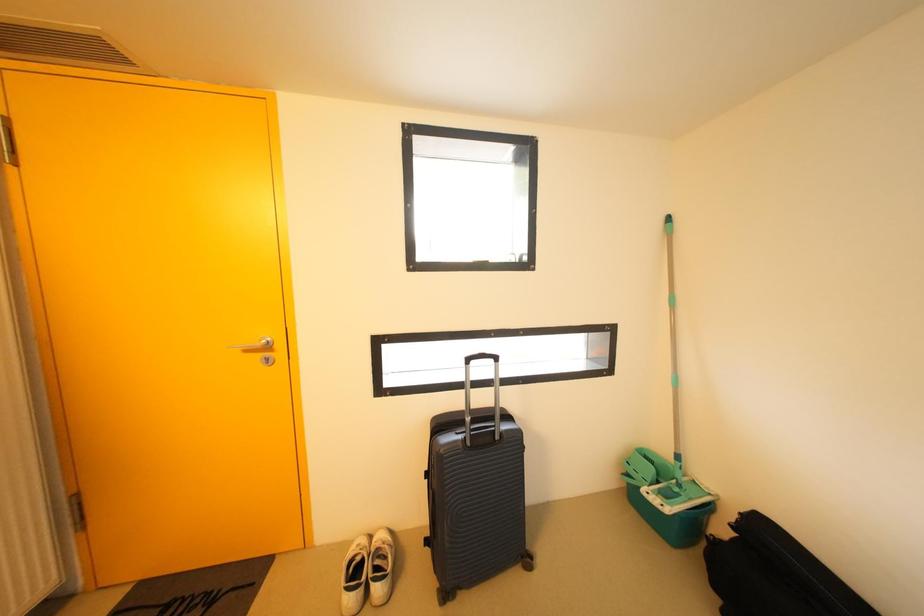
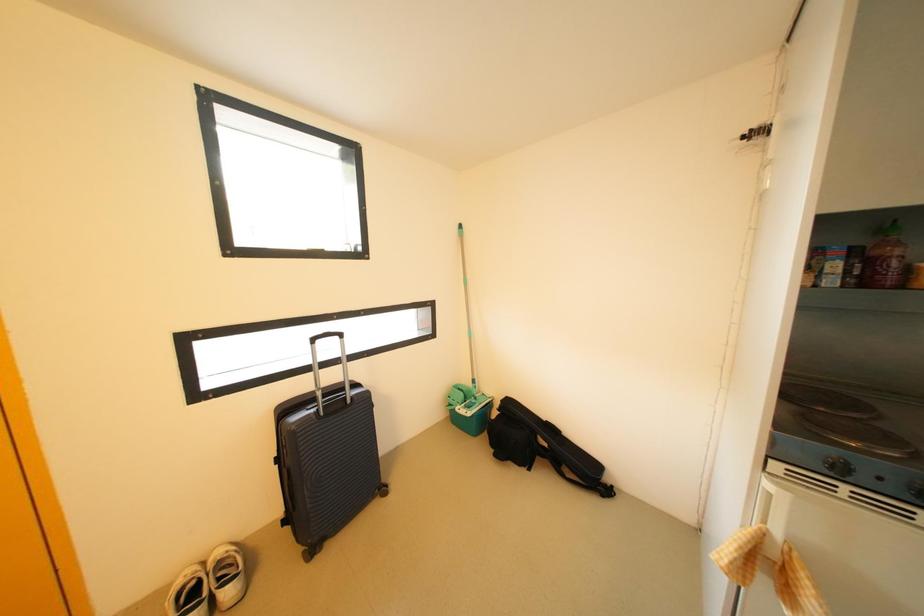
Question: Based on the continuous images, in which direction is the camera rotating? Reply with the corresponding letter.

Choices:
 (A) Left
 (B) Right
 (C) Up
 (D) Down

Answer: (B)